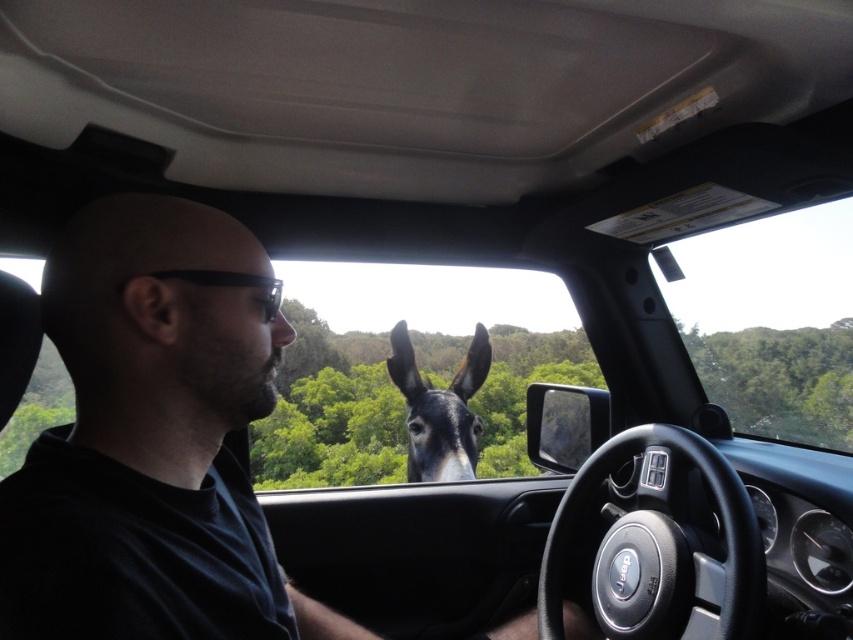
You are a passenger in the car and notice two items inside the vehicle. The first is the black matte shirt at center and the second is the black plastic glasses at left. Which item occupies more vertical space in the scene?

The black matte shirt at center has a greater height compared to the black plastic glasses at left, so it occupies more vertical space in the scene.

You are a passenger in the car and want to hand your black plastic glasses at left to the driver. The black glossy donkey at center is blocking the way. Can you reach the glasses without moving the donkey?

The black glossy donkey at center is below the black plastic glasses at left, so the glasses are above the donkey. You can reach the glasses by moving your hand above the donkey without disturbing it.

You are a passenger in the Jeep. You see the point at coordinates (151, 442). What object is this point located on?

The point at coordinates (151, 442) is located on the black matte shirt at center.